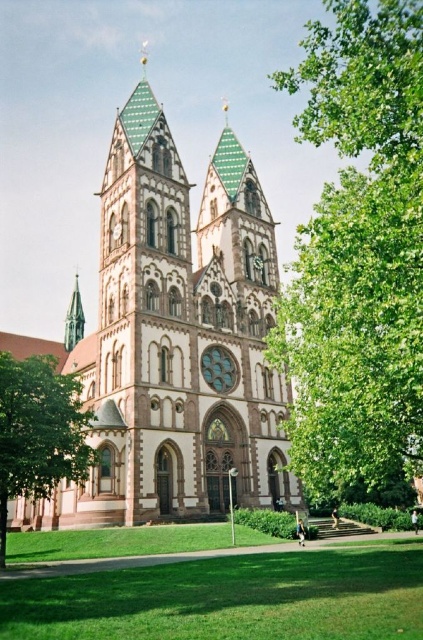
Consider the image. You are a tour guide leading a group to the white stone church at center. You notice a green leafy tree at lower left nearby. If your group wants to take a photo with the church in the background, should they stand closer to the tree or farther away from it to ensure the church is clearly visible in the frame?

The group should stand closer to the green leafy tree at lower left. Since the distance between the white stone church at center and the green leafy tree at lower left is 11.99 meters, positioning themselves near the tree while facing the church will keep the church in the background of their photo, ensuring it remains clearly visible.

You are a landscape architect planning to install a new bench along the pathway leading to the white stone church at center. Considering the green leafy tree at lower left is in the way, how can you position the bench so it doesn

The white stone church at center might be wider than the green leafy tree at lower left, so positioning the bench closer to the church side of the pathway would avoid obstructing the tree while utilizing the available space.

In the scene shown: You are standing at the entrance of the church and want to take a photo of the green leafy tree at lower left and the shiny silver spire at left. Which object should you position to your left side to capture both in the frame?

The green leafy tree at lower left should be positioned to your left side because it is to the right of the shiny silver spire at left, meaning the spire is further to the left. By placing the tree on your left, you can include both in the frame as the spire would naturally be positioned to the left of the tree from your viewpoint.